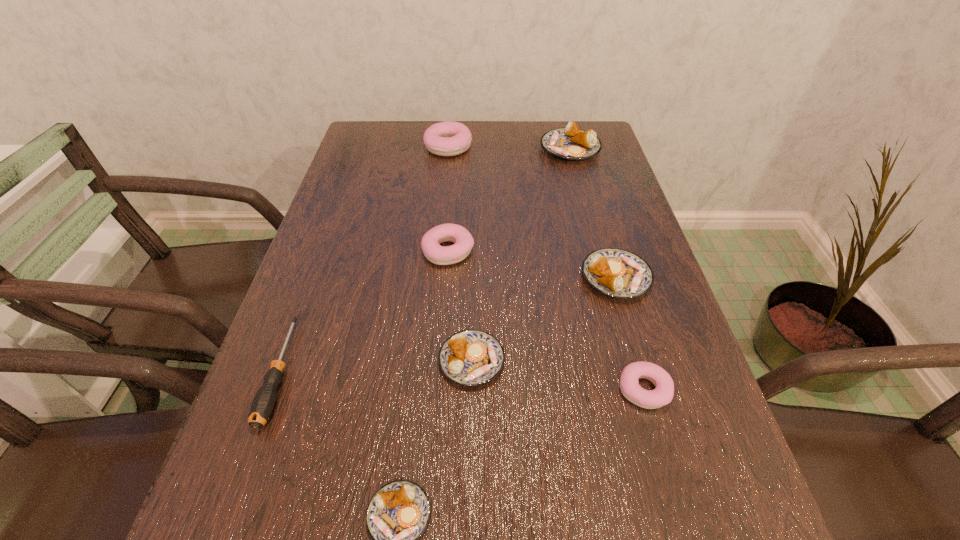
The height and width of the screenshot is (540, 960). Find the location of `vacant space located on the left of the third smallest brown pastry`. vacant space located on the left of the third smallest brown pastry is located at coordinates (446, 278).

This screenshot has height=540, width=960. I want to click on free space located 0.140m on the left of the second smallest pink pastry, so click(361, 251).

Locate an element on the screen. vacant region located 0.060m on the back of the second smallest brown pastry is located at coordinates (472, 310).

This screenshot has height=540, width=960. Identify the location of vacant space positioned on the right of the leftmost object. (363, 372).

You are a GUI agent. You are given a task and a screenshot of the screen. Output one action in this format:
    pyautogui.click(x=<x>, y=<y>)
    Task: Click on the vacant position located 0.170m on the front of the nearest pink pastry
    
    Given the screenshot: What is the action you would take?
    pyautogui.click(x=684, y=526)

Find the location of `object that is at the left edge`. object that is at the left edge is located at coordinates (263, 403).

Find the location of a particular element. This screenshot has width=960, height=540. object that is at the far right corner is located at coordinates (572, 143).

Where is `free space at the far edge`? free space at the far edge is located at coordinates (492, 150).

Locate an element on the screen. This screenshot has width=960, height=540. vacant area at the left edge is located at coordinates (257, 467).

I want to click on vacant space at the right edge of the desktop, so click(628, 313).